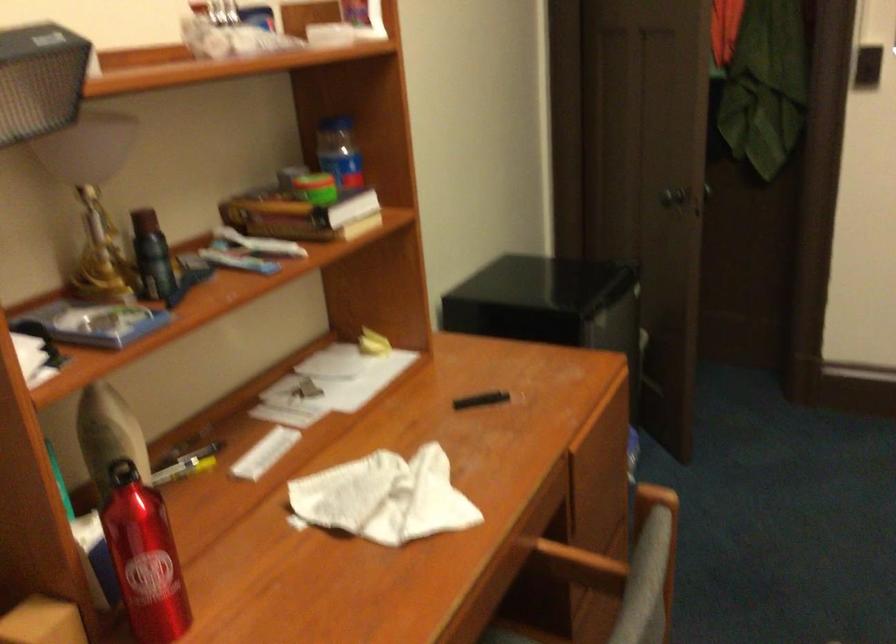
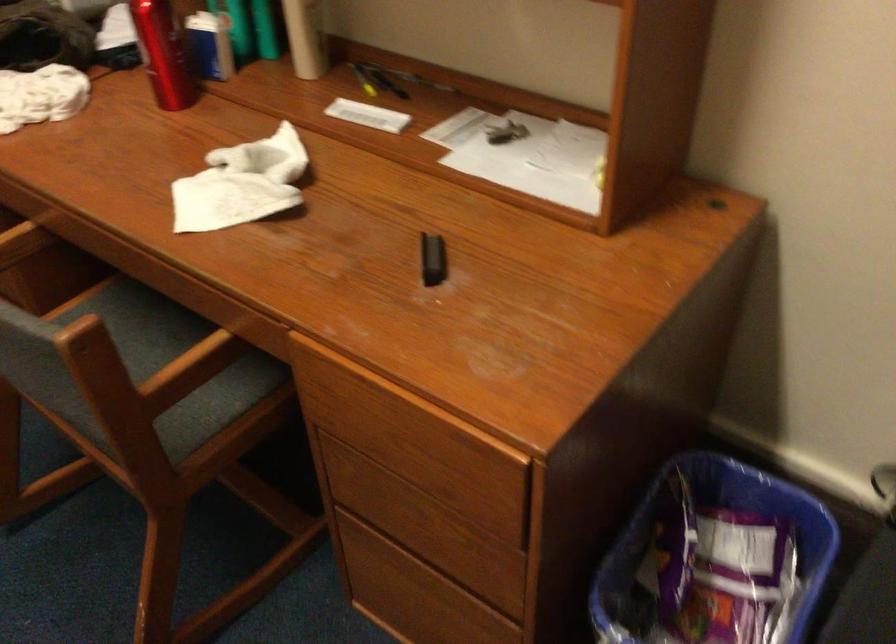
Locate, in the second image, the point that corresponds to point (173, 471) in the first image.

(363, 80)